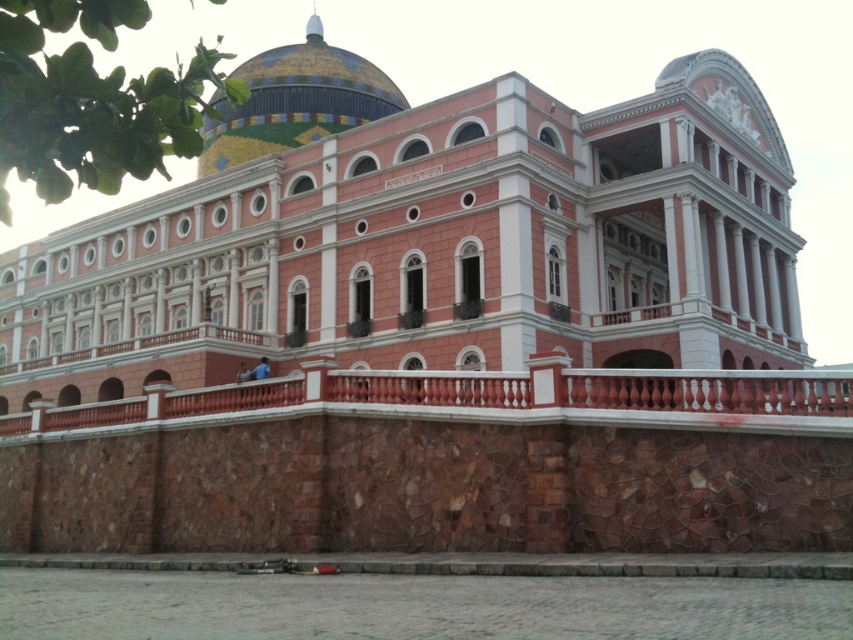
Does pink stone building at center come behind mosaic tile dome at upper center?

No, it is in front of mosaic tile dome at upper center.

You are a GUI agent. You are given a task and a screenshot of the screen. Output one action in this format:
    pyautogui.click(x=<x>, y=<y>)
    Task: Click on the pink stone building at center
    This screenshot has height=640, width=853.
    Given the screenshot: What is the action you would take?
    [x=425, y=236]

The height and width of the screenshot is (640, 853). I want to click on pink stone building at center, so click(x=425, y=236).

Who is more forward, (630, 380) or (225, 132)?

Point (630, 380) is more forward.

Between red stone railing at center and mosaic tile dome at upper center, which one appears on the left side from the viewer's perspective?

mosaic tile dome at upper center

What are the coordinates of `red stone railing at center` in the screenshot? It's located at (474, 396).

Who is more distant from viewer, (543, 324) or (7, 428)?

The point (7, 428) is more distant.

Between pink stone building at center and red stone railing at center, which one is positioned lower?

red stone railing at center is below.

The height and width of the screenshot is (640, 853). I want to click on pink stone building at center, so click(425, 236).